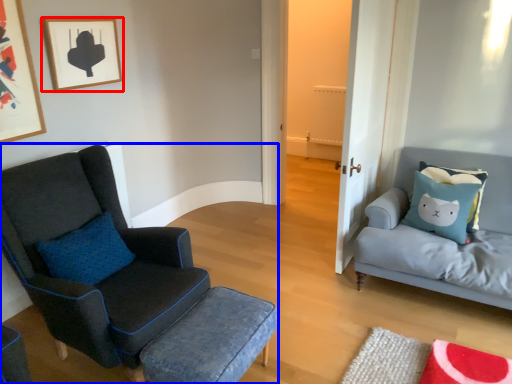
Question: Which object appears farthest to the camera in this image, picture frame (highlighted by a red box) or chair (highlighted by a blue box)?

Choices:
 (A) picture frame
 (B) chair

Answer: (A)